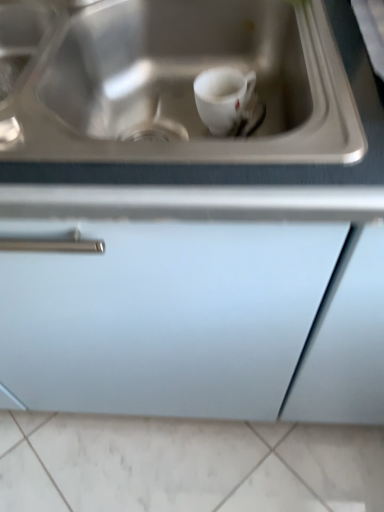
Question: Do you think white glossy mug at center is within stainless steel sink at upper center, or outside of it?

Choices:
 (A) inside
 (B) outside

Answer: (A)

Question: Is point (241, 102) closer or farther from the camera than point (292, 125)?

Choices:
 (A) farther
 (B) closer

Answer: (A)

Question: Estimate the real-world distances between objects in this image. Which object is closer to the white marble tile at lower center?

Choices:
 (A) stainless steel sink at upper center
 (B) white glossy mug at center
 (C) matte white cabinet at center

Answer: (C)

Question: Considering the real-world distances, which object is farthest from the white marble tile at lower center?

Choices:
 (A) white glossy mug at center
 (B) matte white cabinet at center
 (C) stainless steel sink at upper center

Answer: (A)